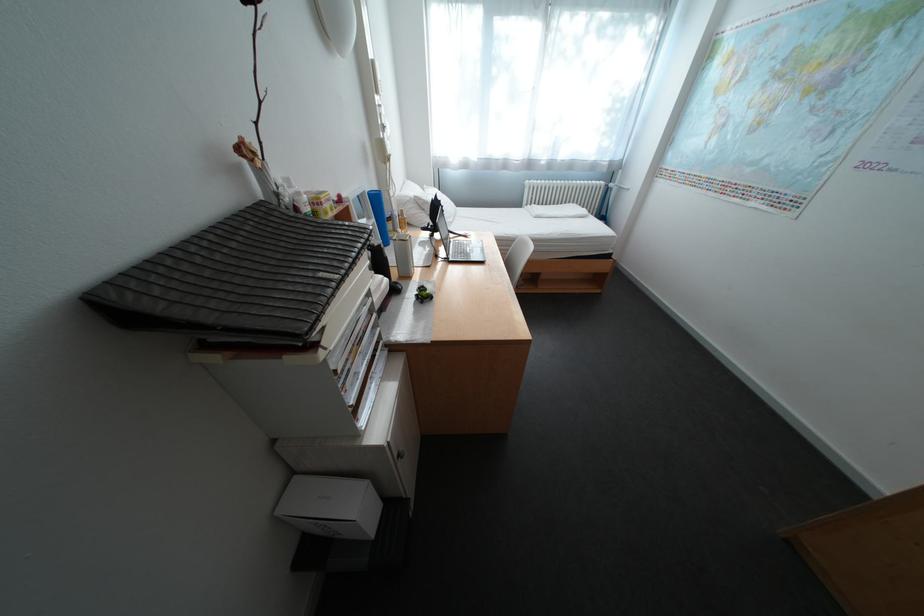
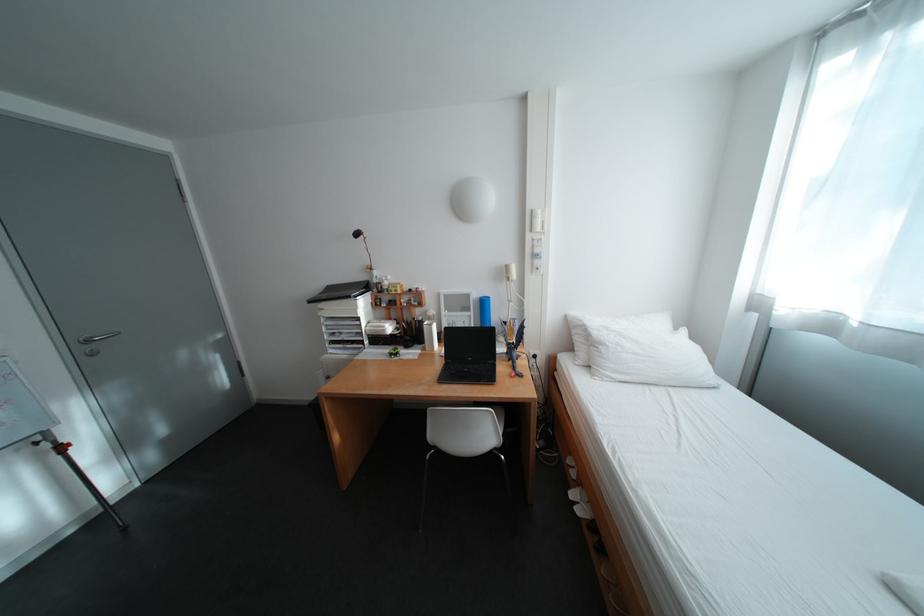
Where in the second image is the point corresponding to (x=385, y=63) from the first image?

(544, 213)